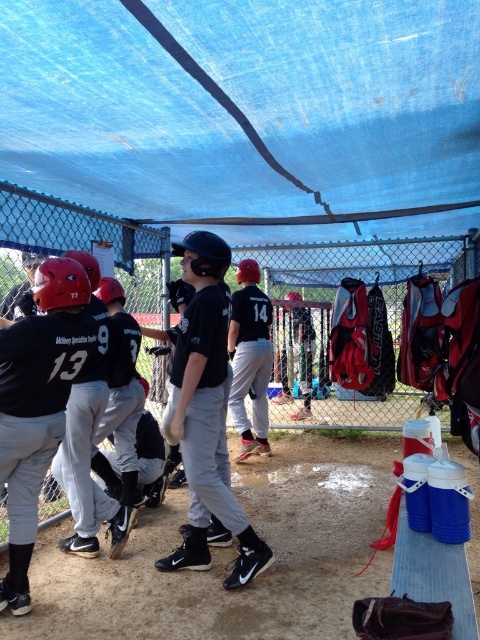
Question: Which of the following is the closest to the observer?

Choices:
 (A) (255, 330)
 (B) (264, 566)
 (C) (425, 611)
 (D) (213, 266)

Answer: (C)

Question: Is matte black helmet at center positioned at the back of black matte jersey at center?

Choices:
 (A) yes
 (B) no

Answer: (B)

Question: Can you confirm if black matte uniform at center is positioned above black matte jersey at center?

Choices:
 (A) yes
 (B) no

Answer: (B)

Question: Which point appears farthest from the camera in this image?

Choices:
 (A) (12, 339)
 (B) (193, 467)
 (C) (251, 323)

Answer: (C)

Question: Can you confirm if black matte jersey at left is positioned above black matte uniform at center?

Choices:
 (A) no
 (B) yes

Answer: (A)

Question: Among these points, which one is farthest from the camera?

Choices:
 (A) (78, 292)
 (B) (232, 576)

Answer: (B)